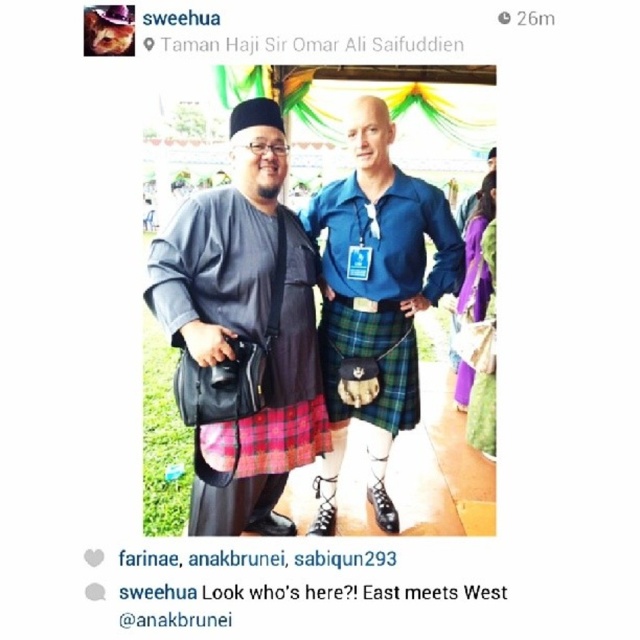
Question: Observing the image, what is the correct spatial positioning of plaid fabric kilt at center in reference to plaid fabric at center?

Choices:
 (A) below
 (B) above

Answer: (B)

Question: Can you confirm if matte black kilt at center is thinner than plaid fabric kilt at center?

Choices:
 (A) yes
 (B) no

Answer: (B)

Question: Is the position of blue plaid kilt at center less distant than that of plaid fabric kilt at center?

Choices:
 (A) yes
 (B) no

Answer: (A)

Question: Which of the following is the closest to the observer?

Choices:
 (A) blue plaid kilt at center
 (B) plaid fabric kilt at center
 (C) plaid fabric at center
 (D) matte black kilt at center

Answer: (D)

Question: Among these objects, which one is farthest from the camera?

Choices:
 (A) plaid fabric kilt at center
 (B) blue plaid kilt at center

Answer: (A)

Question: Considering the real-world distances, which object is closest to the plaid fabric at center?

Choices:
 (A) matte black kilt at center
 (B) blue plaid kilt at center
 (C) plaid fabric kilt at center

Answer: (A)